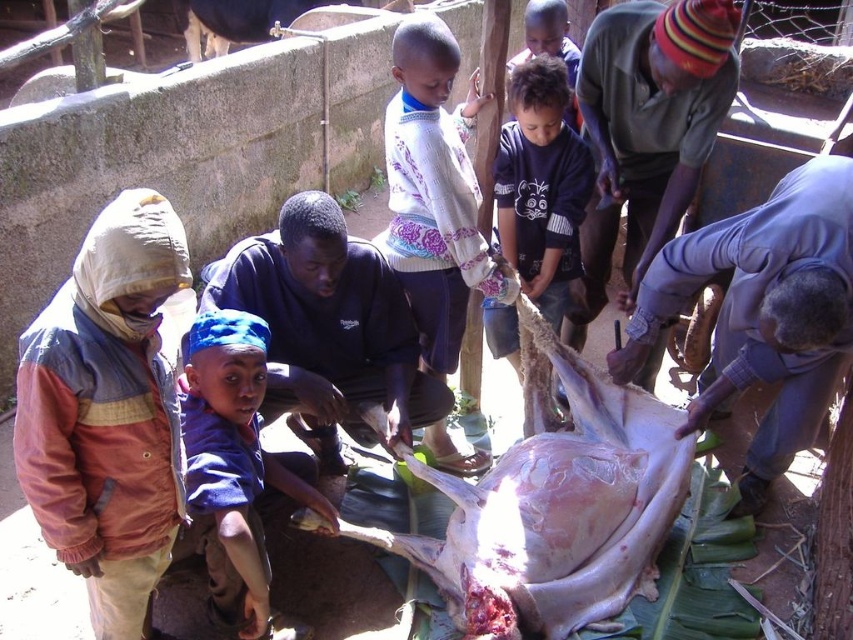
You are a photographer trying to capture a closeup of the raw flesh at center while also including the blue fabric headband at lower left in the frame. Based on their sizes, will you need to adjust your camera angle to include both?

The raw flesh at center is taller than the blue fabric headband at lower left, so you will need to adjust your camera angle to ensure both fit in the frame.

You are organizing a community event and need to arrange items based on their size. You have a blue fabric headband at lower left and a dark blue cotton shirt at center. Which item should you place first if you are starting from the left side and moving to the right, considering their sizes?

The blue fabric headband at lower left should be placed first since it occupies less space than the dark blue cotton shirt at center, allowing for proper arrangement from left to right based on size.

From the picture: You are a photographer trying to capture a closeup of the raw flesh at center without including the blue fabric headband at lower left in the frame. Based on their sizes, is this possible?

The raw flesh at center might be wider than blue fabric headband at lower left, so it might be possible to frame the shot to exclude the blue fabric headband at lower left if positioned correctly.